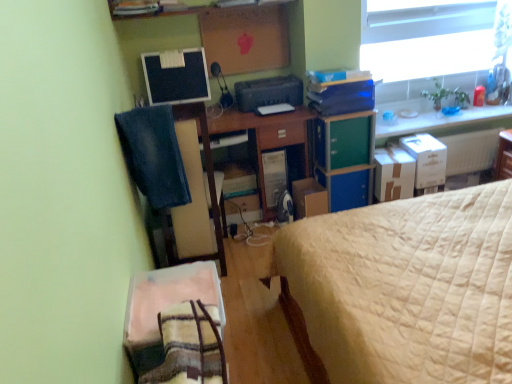
Identify the location of matte black monitor at upper center. (176, 76).

This screenshot has height=384, width=512. Describe the element at coordinates (309, 198) in the screenshot. I see `cardboard box at center, positioned as the 1th cardboard box in left-to-right order` at that location.

What is the approximate width of beige quilted bed at right?

1.44 meters.

Describe the element at coordinates (153, 156) in the screenshot. I see `denim at left` at that location.

At what (x,y) coordinates should I click in order to perform the action: click on denim at left. Please return your answer as a coordinate pair (x, y). The height and width of the screenshot is (384, 512). Looking at the image, I should click on (153, 156).

Identify the location of brown cardboard box at right, which is counted as the 2th cardboard box, starting from the right. This screenshot has width=512, height=384. (393, 174).

Identify the location of green leafy plant at upper right. This screenshot has height=384, width=512. (446, 95).

Image resolution: width=512 pixels, height=384 pixels. Describe the element at coordinates (345, 158) in the screenshot. I see `green plastic file cabinet at center` at that location.

This screenshot has width=512, height=384. I want to click on matte black monitor at upper center, so click(x=176, y=76).

This screenshot has height=384, width=512. I want to click on houseplant above the black plastic printer at center (from the image's perspective), so click(x=446, y=95).

Who is shorter, green leafy plant at upper right or black plastic printer at center?

black plastic printer at center.

Can black plastic printer at center be found inside green leafy plant at upper right?

Definitely not — black plastic printer at center is not inside green leafy plant at upper right.

From the picture: Does green leafy plant at upper right appear on the left side of black plastic printer at center?

Incorrect, green leafy plant at upper right is not on the left side of black plastic printer at center.

Can you confirm if satin black computer tower at center is thinner than transparent glass window at upper right?

In fact, satin black computer tower at center might be wider than transparent glass window at upper right.

From the image's perspective, between satin black computer tower at center and transparent glass window at upper right, which one is located above?

transparent glass window at upper right is shown above in the image.

Considering the relative sizes of satin black computer tower at center and transparent glass window at upper right in the image provided, is satin black computer tower at center taller than transparent glass window at upper right?

Incorrect, the height of satin black computer tower at center is not larger of that of transparent glass window at upper right.

Where is `window located on the right of satin black computer tower at center`? The image size is (512, 384). window located on the right of satin black computer tower at center is located at coordinates (435, 40).

Does green plastic file cabinet at center come behind black plastic printer at center?

No, it is not.

Which object is thinner, green plastic file cabinet at center or black plastic printer at center?

green plastic file cabinet at center is thinner.

Does green plastic file cabinet at center turn towards black plastic printer at center?

No, green plastic file cabinet at center is not facing towards black plastic printer at center.

Is green plastic file cabinet at center not near black plastic printer at center?

No, green plastic file cabinet at center is not far away from black plastic printer at center.

From the image's perspective, which one is positioned lower, white cardboard box at upper right, which ranks as the 3th cardboard box in left-to-right order, or plaid fabric blanket at lower left?

plaid fabric blanket at lower left is shown below in the image.

Would you say white cardboard box at upper right, which ranks as the 3th cardboard box in left-to-right order, contains plaid fabric blanket at lower left?

That's incorrect, plaid fabric blanket at lower left is not inside white cardboard box at upper right, which ranks as the 3th cardboard box in left-to-right order.

Between white cardboard box at upper right, which ranks as the 3th cardboard box in left-to-right order, and plaid fabric blanket at lower left, which one has more height?

With more height is white cardboard box at upper right, which ranks as the 3th cardboard box in left-to-right order.

Is white cardboard box at upper right, the first cardboard box viewed from the right, oriented towards plaid fabric blanket at lower left?

No, white cardboard box at upper right, the first cardboard box viewed from the right, is not turned towards plaid fabric blanket at lower left.

From the image's perspective, is green leafy plant at upper right over plaid fabric blanket at lower left?

Yes.

Would you say plaid fabric blanket at lower left is part of green leafy plant at upper right's contents?

That's incorrect, plaid fabric blanket at lower left is not inside green leafy plant at upper right.

Does green leafy plant at upper right lie behind plaid fabric blanket at lower left?

Yes, green leafy plant at upper right is further from the viewer.

Could you tell me if green leafy plant at upper right is turned towards plaid fabric blanket at lower left?

No, green leafy plant at upper right does not turn towards plaid fabric blanket at lower left.

Locate an element on the screen. This screenshot has width=512, height=384. bed located underneath the green leafy plant at upper right (from a real-world perspective) is located at coordinates (405, 289).

Are beige quilted bed at right and green leafy plant at upper right making contact?

No, beige quilted bed at right is not in contact with green leafy plant at upper right.

Can we say beige quilted bed at right lies outside green leafy plant at upper right?

That's correct, beige quilted bed at right is outside of green leafy plant at upper right.

How different are the orientations of transparent glass window at upper right and brown cardboard box at right, the second cardboard box viewed from the left, in degrees?

The angular difference between transparent glass window at upper right and brown cardboard box at right, the second cardboard box viewed from the left, is 4.55 degrees.

Between transparent glass window at upper right and brown cardboard box at right, which is counted as the 2th cardboard box, starting from the right, which one has smaller width?

transparent glass window at upper right.

In the scene shown: Are transparent glass window at upper right and brown cardboard box at right, the second cardboard box viewed from the left, beside each other?

transparent glass window at upper right and brown cardboard box at right, the second cardboard box viewed from the left, are clearly separated.

In the scene shown: Is transparent glass window at upper right spatially inside brown cardboard box at right, which is counted as the 2th cardboard box, starting from the right, or outside of it?

The correct answer is: outside.

In the image, there is a black plastic printer at center. Where is `houseplant above it (from the image's perspective)`? houseplant above it (from the image's perspective) is located at coordinates (446, 95).

Identify the location of computer tower below the transparent glass window at upper right (from the image's perspective). The height and width of the screenshot is (384, 512). (275, 177).

From the image, which object appears to be nearer to white cardboard box at upper right, which ranks as the 3th cardboard box in left-to-right order, matte black monitor at upper center or brown cardboard box at right, which is counted as the 2th cardboard box, starting from the right?

brown cardboard box at right, which is counted as the 2th cardboard box, starting from the right.

When comparing their distances from transparent glass window at upper right, does black plastic printer at center or green plastic file cabinet at center seem further?

The object further to transparent glass window at upper right is black plastic printer at center.

When comparing their distances from cardboard box at center, positioned as the 1th cardboard box in left-to-right order, does plaid fabric blanket at lower left or black plastic printer at center seem closer?

The object closer to cardboard box at center, positioned as the 1th cardboard box in left-to-right order, is black plastic printer at center.

Considering their positions, is wooden desk at center positioned further to denim at left than transparent glass window at upper right?

transparent glass window at upper right.

Estimate the real-world distances between objects in this image. Which object is further from brown cardboard box at right, the second cardboard box viewed from the left, black plastic printer at center or matte black monitor at upper center?

Among the two, matte black monitor at upper center is located further to brown cardboard box at right, the second cardboard box viewed from the left.

Based on their spatial positions, is matte black monitor at upper center or green leafy plant at upper right further from green plastic file cabinet at center?

Among the two, matte black monitor at upper center is located further to green plastic file cabinet at center.

When comparing their distances from plaid fabric blanket at lower left, does green plastic file cabinet at center or matte black monitor at upper center seem further?

matte black monitor at upper center is further to plaid fabric blanket at lower left.

Which object lies further to the anchor point denim at left, matte black monitor at upper center or cardboard box at center, the 3th cardboard box viewed from the right?

cardboard box at center, the 3th cardboard box viewed from the right, is further to denim at left.

Image resolution: width=512 pixels, height=384 pixels. What are the coordinates of `printer located between wooden desk at center and brown cardboard box at right, which is counted as the 2th cardboard box, starting from the right, in the left-right direction` in the screenshot? It's located at (x=268, y=92).

At what (x,y) coordinates should I click in order to perform the action: click on sheet between denim at left and white cardboard box at upper right, which ranks as the 3th cardboard box in left-to-right order. Please return your answer as a coordinate pair (x, y). Looking at the image, I should click on (168, 298).

Identify the location of desk between denim at left and transparent glass window at upper right in the horizontal direction. (268, 140).

The image size is (512, 384). Identify the location of printer between plaid fabric blanket at lower left and cardboard box at center, the 3th cardboard box viewed from the right, in the front-back direction. (268, 92).